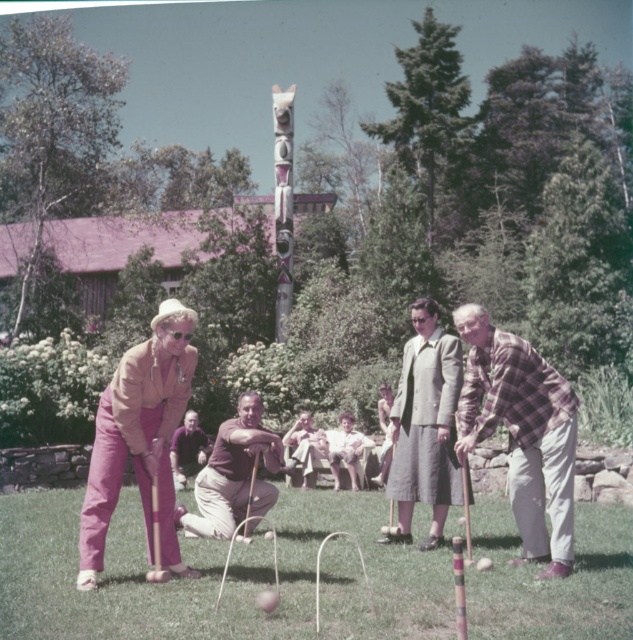
Question: Is brown cotton shirt at center to the left of carved wood totem pole at center from the viewer's perspective?

Choices:
 (A) yes
 (B) no

Answer: (B)

Question: Which of the following is the closest to the observer?

Choices:
 (A) dark brown leather jacket at center
 (B) gray woolen suit at center

Answer: (B)

Question: Among these points, which one is farthest from the camera?

Choices:
 (A) (175, 384)
 (B) (280, 157)

Answer: (B)

Question: Is gray woolen suit at center closer to the viewer compared to carved wood totem pole at center?

Choices:
 (A) no
 (B) yes

Answer: (B)

Question: Is carved wood totem pole at center behind dark brown leather jacket at center?

Choices:
 (A) yes
 (B) no

Answer: (A)

Question: Which is farther from the dark brown leather jacket at center?

Choices:
 (A) gray woolen suit at center
 (B) brown cotton shirt at center
 (C) matte pink pants at center

Answer: (C)